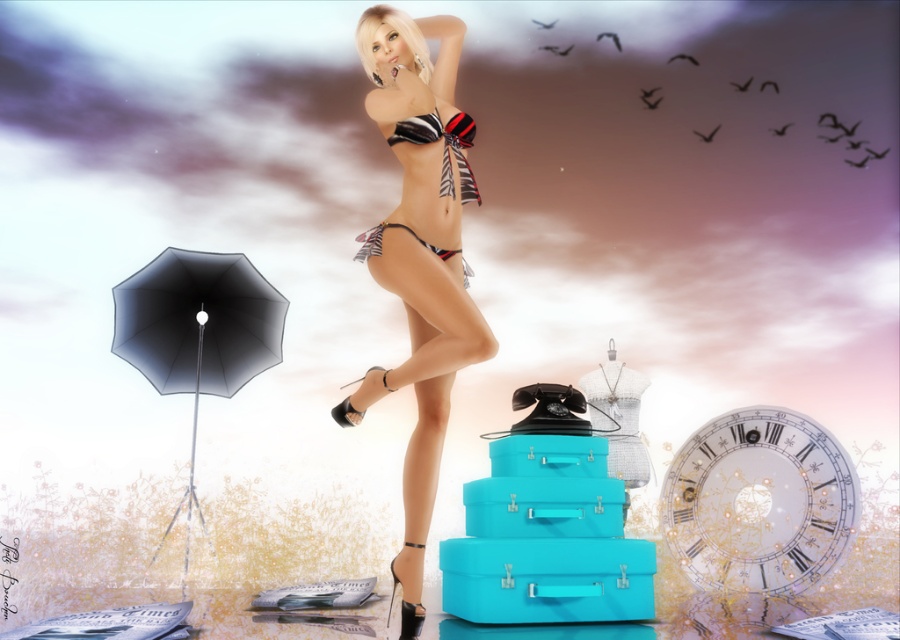
Find the location of a particular element. This screenshot has width=900, height=640. zebra print bikini at center is located at coordinates (419, 257).

Is zebra print bikini at center behind zebra print fabric bikini at center?

No, zebra print bikini at center is closer to the viewer.

Does point (400, 208) lie in front of point (468, 115)?

No, it is behind (468, 115).

At what (x,y) coordinates should I click in order to perform the action: click on zebra print bikini at center. Please return your answer as a coordinate pair (x, y). This screenshot has width=900, height=640. Looking at the image, I should click on (419, 257).

Can you confirm if white glossy clock at center right is positioned to the right of zebra print fabric bikini top at center?

Indeed, white glossy clock at center right is positioned on the right side of zebra print fabric bikini top at center.

The image size is (900, 640). What do you see at coordinates (759, 500) in the screenshot?
I see `white glossy clock at center right` at bounding box center [759, 500].

Locate an element on the screen. The width and height of the screenshot is (900, 640). white glossy clock at center right is located at coordinates (759, 500).

Does white glossy clock at center right have a smaller size compared to zebra print fabric bikini at center?

Actually, white glossy clock at center right might be larger than zebra print fabric bikini at center.

Does white glossy clock at center right have a larger size compared to zebra print fabric bikini at center?

Indeed, white glossy clock at center right has a larger size compared to zebra print fabric bikini at center.

Which is in front, point (761, 468) or point (444, 259)?

Point (444, 259) is more forward.

This screenshot has width=900, height=640. I want to click on white glossy clock at center right, so click(x=759, y=500).